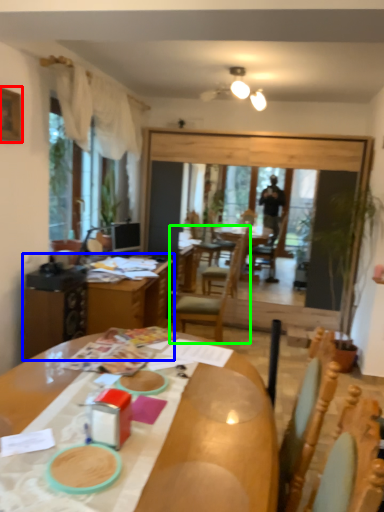
Question: Which object is the farthest from picture frame (highlighted by a red box)? Choose among these: table (highlighted by a blue box) or chair (highlighted by a green box).

Choices:
 (A) table
 (B) chair

Answer: (B)